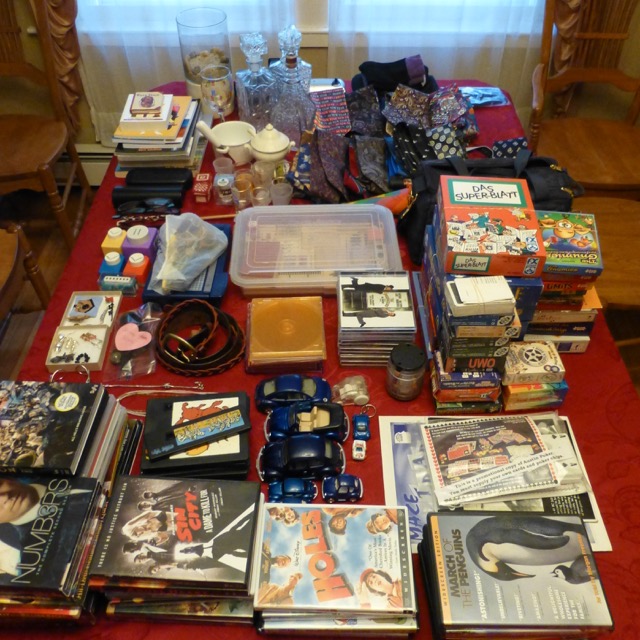
Image resolution: width=640 pixels, height=640 pixels. I want to click on windows, so click(400, 17), click(148, 8).